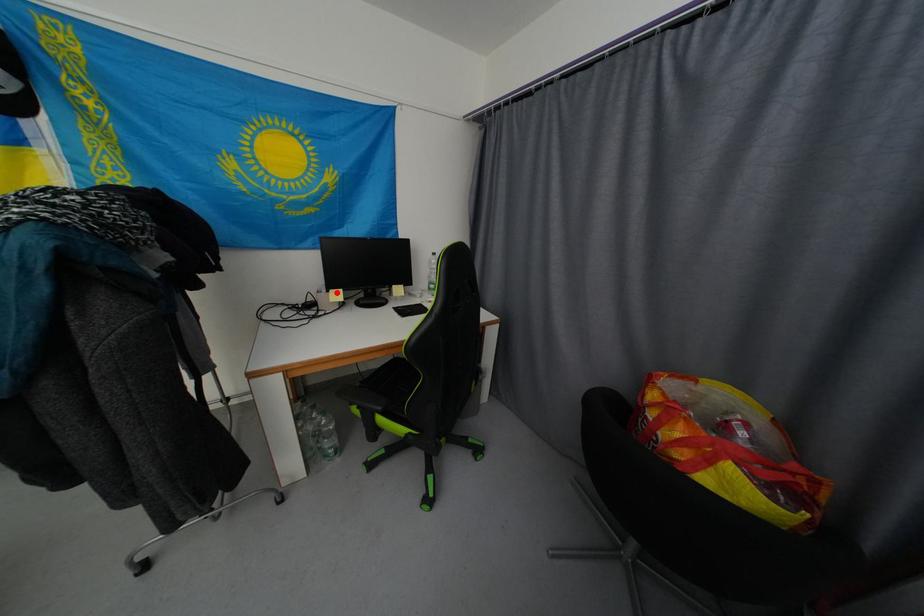
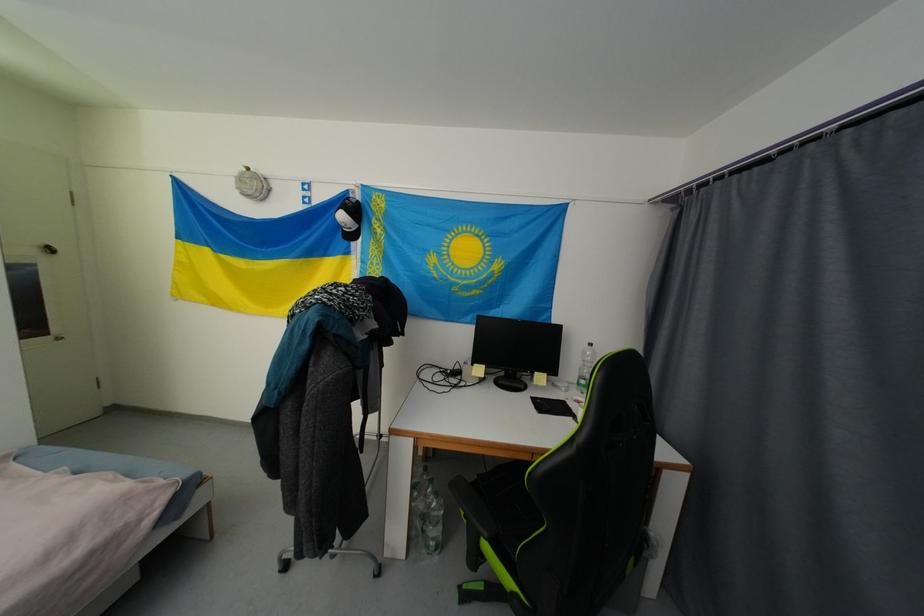
Where in the second image is the point corresponding to the highlighted location from the first image?

(480, 367)